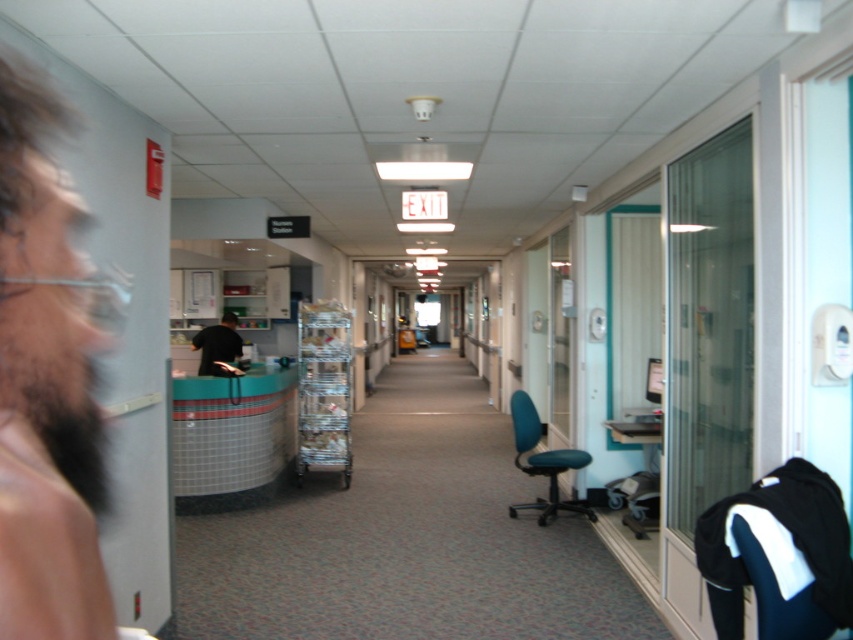
Which is above, brown skin at left or black fabric swivel chair at lower right?

brown skin at left

Can you confirm if brown skin at left is bigger than black fabric swivel chair at lower right?

Yes, brown skin at left is bigger than black fabric swivel chair at lower right.

Does point (74, 326) come closer to viewer compared to point (813, 577)?

That is True.

This screenshot has height=640, width=853. In order to click on brown skin at left in this screenshot , I will do `click(47, 380)`.

Can you confirm if black fabric swivel chair at lower right is positioned above black matte shirt at center?

No.

Does black fabric swivel chair at lower right have a lesser width compared to black matte shirt at center?

Correct, black fabric swivel chair at lower right's width is less than black matte shirt at center's.

Which is behind, point (755, 493) or point (236, 317)?

The point (236, 317) is more distant.

This screenshot has width=853, height=640. Find the location of `black fabric swivel chair at lower right`. black fabric swivel chair at lower right is located at coordinates (779, 545).

Is the position of brown skin at left less distant than that of black matte shirt at center?

That is True.

You are a GUI agent. You are given a task and a screenshot of the screen. Output one action in this format:
    pyautogui.click(x=<x>, y=<y>)
    Task: Click on the brown skin at left
    The height and width of the screenshot is (640, 853).
    Given the screenshot: What is the action you would take?
    pyautogui.click(x=47, y=380)